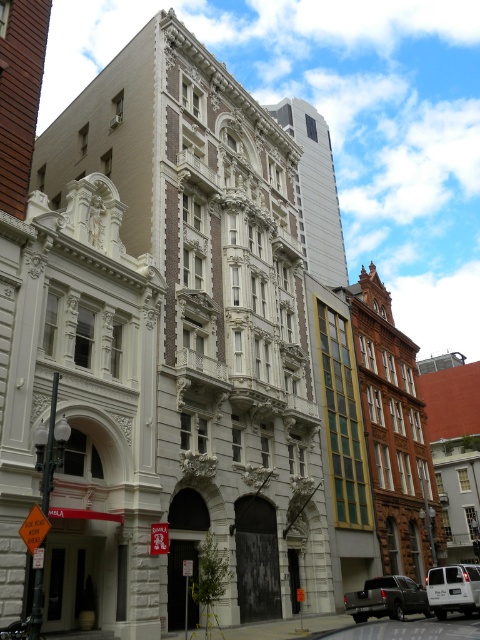
Based on the photo, is metallic gray truck at center to the right of white matte van at center from the viewer's perspective?

No, metallic gray truck at center is not to the right of white matte van at center.

Is point (384, 608) farther from camera compared to point (428, 598)?

No, (384, 608) is in front of (428, 598).

Locate an element on the screen. Image resolution: width=480 pixels, height=640 pixels. metallic gray truck at center is located at coordinates (386, 598).